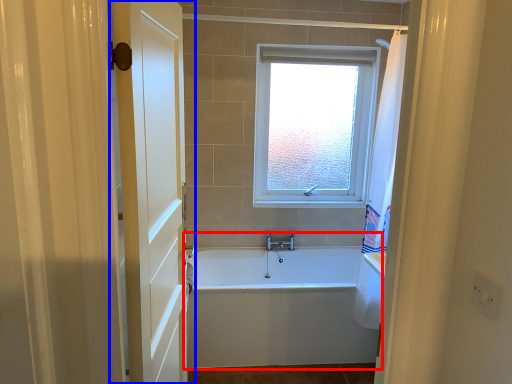
Question: Which of the following is the farthest to the observer, bathtub (highlighted by a red box) or door (highlighted by a blue box)?

Choices:
 (A) bathtub
 (B) door

Answer: (A)